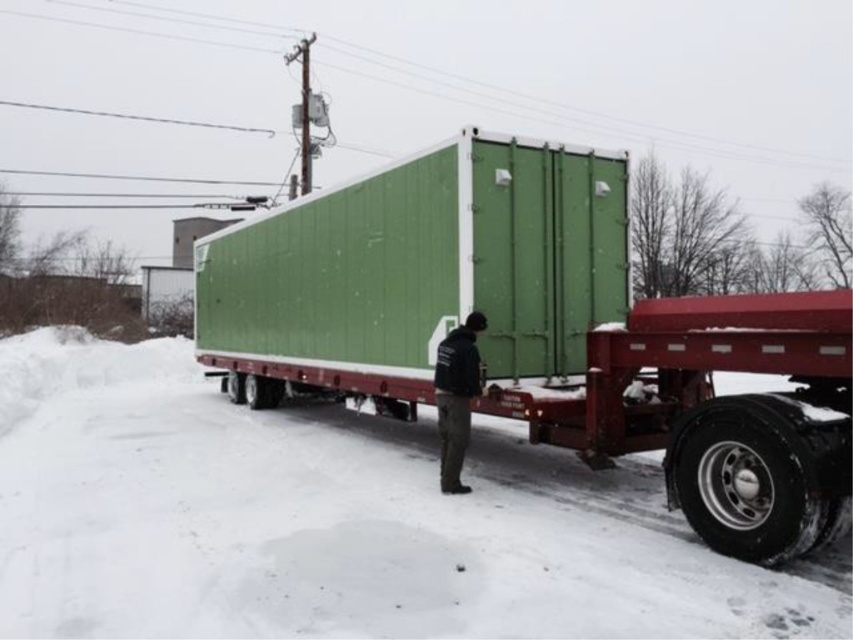
You are a delivery driver who needs to load a new package onto the trailer. The package is the size of the dark green jacket at center. Can you place it on top of the green matte container at center without exceeding the container height?

The green matte container at center has a larger size compared to the dark green jacket at center. Since the container is larger, placing the package on top of it should be possible as long as the height of the jacket package does not exceed the container height. However, the description does not specify the height difference, so we cannot confirm if it will fit vertically.

You are standing at the point marked by the coordinates point (370, 465) in the snowy outdoor scene. You want to walk to the nearest building, which is located 30 feet away from your current position. Can you reach the building without moving more than 30 feet?

The point (370, 465) and viewer are 29.89 feet apart, so yes, you can reach the building without moving more than 30 feet since the distance is slightly less than 30 feet.

Looking at this image, you are a delivery driver who needs to park your truck on the snowy ground near the white powdery snow at lower center. The truck requires a parking spot that is at least 2 meters away from the green shipping container mounted on a flatbed trailer. Can you park your truck safely in the available area?

The white powdery snow at lower center is located at coordinates point (x=335, y=522). Since the truck needs to be at least 2 meters away from the green shipping container mounted on a flatbed trailer, the driver must ensure the parking spot meets this distance requirement. However, without knowing the exact distance between the snow location and the container, it is impossible to confirm if the parking is safe.